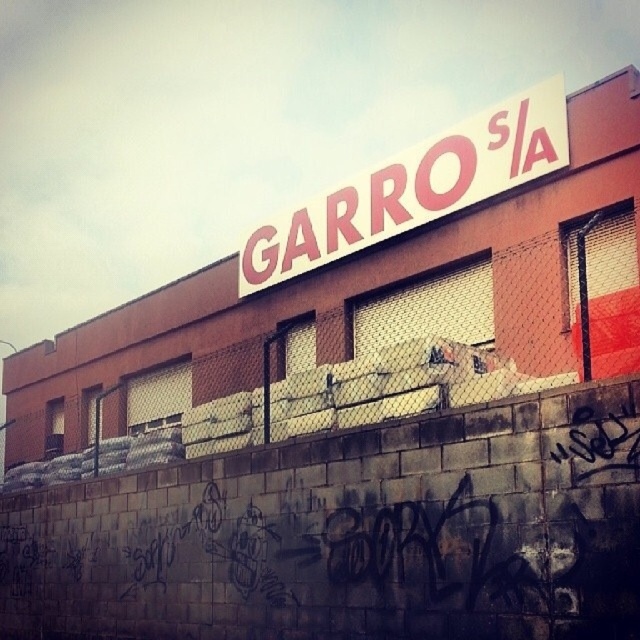
Which of these two, metal mesh fence at upper center or white matte sign at upper center, stands taller?

metal mesh fence at upper center

Does point (420, 397) come in front of point (321, 208)?

Yes.

I want to click on metal mesh fence at upper center, so click(x=342, y=371).